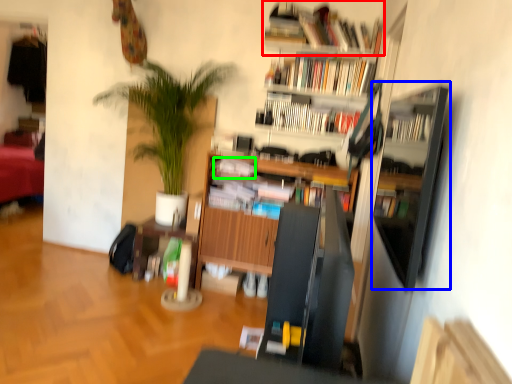
Question: Which object is the closest to the book (highlighted by a red box)? Choose among these: shelf (highlighted by a blue box) or book (highlighted by a green box).

Choices:
 (A) shelf
 (B) book

Answer: (B)